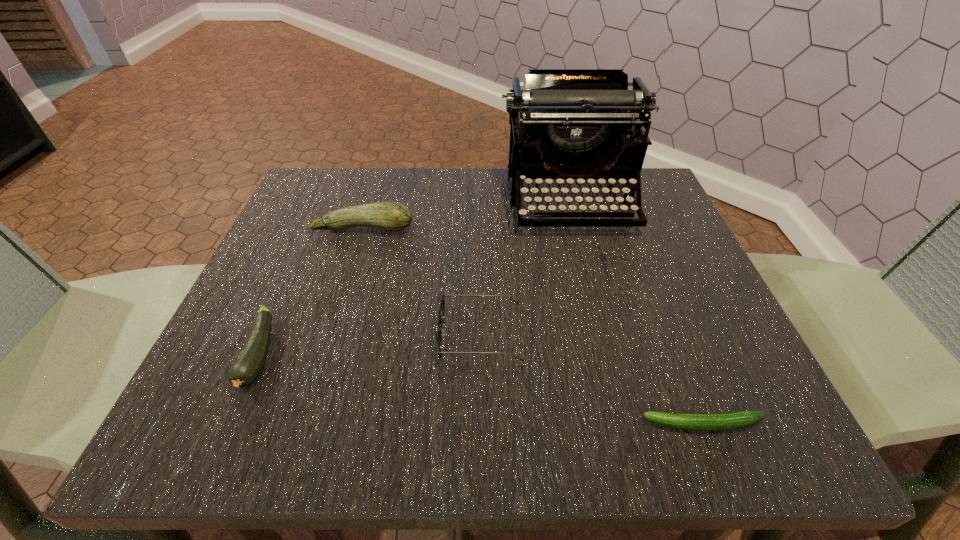
Locate an element on the screen. The width and height of the screenshot is (960, 540). vacant point located between the spectacles and the rightmost zucchini is located at coordinates (592, 381).

This screenshot has width=960, height=540. In order to click on free space that is in between the farthest zucchini and the nearest object in this screenshot , I will do [x=533, y=326].

What are the coordinates of `free space between the second nearest zucchini and the farthest zucchini` in the screenshot? It's located at (311, 292).

Image resolution: width=960 pixels, height=540 pixels. I want to click on free spot between the nearest object and the farthest zucchini, so click(533, 326).

I want to click on unoccupied area between the tallest zucchini and the second tallest zucchini, so click(x=311, y=292).

Where is `blank region between the tallest object and the shortest object`? The height and width of the screenshot is (540, 960). blank region between the tallest object and the shortest object is located at coordinates (636, 312).

I want to click on blank region between the second tallest zucchini and the tallest object, so click(x=415, y=278).

Locate an element on the screen. The width and height of the screenshot is (960, 540). empty space that is in between the fourth shortest object and the second shortest zucchini is located at coordinates (311, 292).

Find the location of a particular element. Image resolution: width=960 pixels, height=540 pixels. empty space between the shortest zucchini and the spectacles is located at coordinates (592, 381).

The image size is (960, 540). In order to click on the second closest object to the tallest object in this screenshot , I will do `click(442, 305)`.